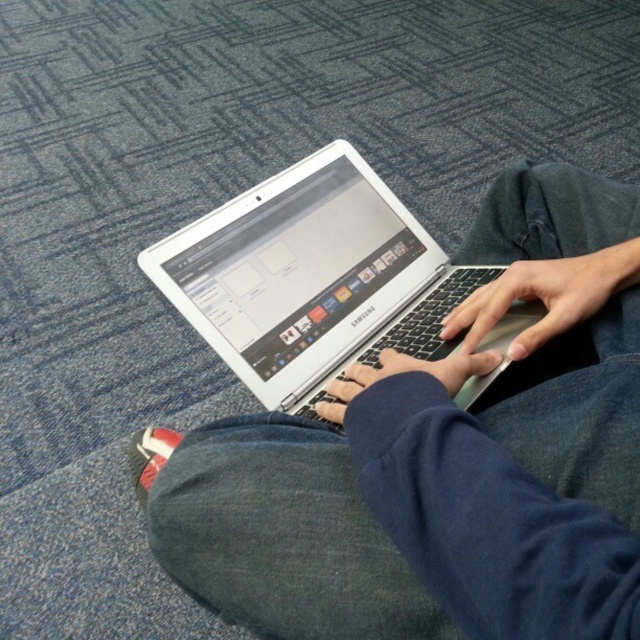
Does point (506, 172) come farther from viewer compared to point (360, 260)?

No, (506, 172) is closer to viewer.

Does white glossy laptop at center have a lesser height compared to silver metallic laptop at center?

In fact, white glossy laptop at center may be taller than silver metallic laptop at center.

The height and width of the screenshot is (640, 640). What are the coordinates of `white glossy laptop at center` in the screenshot? It's located at (442, 460).